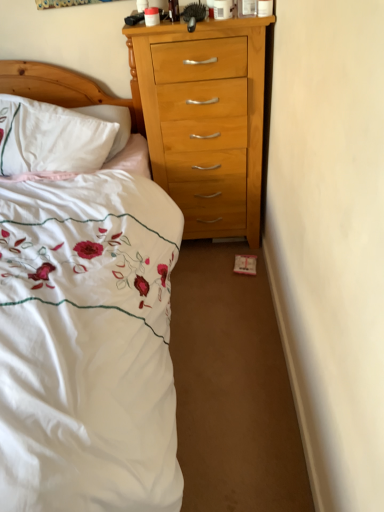
Question: Should I look upward or downward to see white embroidered bed at left?

Choices:
 (A) up
 (B) down

Answer: (B)

Question: Is white embroidered bed at left wider than white soft pillow at left?

Choices:
 (A) no
 (B) yes

Answer: (B)

Question: From the image's perspective, is white embroidered bed at left on white soft pillow at left?

Choices:
 (A) yes
 (B) no

Answer: (B)

Question: Is white embroidered bed at left facing towards white soft pillow at left?

Choices:
 (A) no
 (B) yes

Answer: (A)

Question: Does white embroidered bed at left have a larger size compared to white soft pillow at left?

Choices:
 (A) yes
 (B) no

Answer: (A)

Question: From a real-world perspective, is white embroidered bed at left under white soft pillow at left?

Choices:
 (A) yes
 (B) no

Answer: (A)

Question: Is white embroidered bed at left further to camera compared to white soft pillow at left?

Choices:
 (A) yes
 (B) no

Answer: (B)

Question: Considering the relative sizes of white soft pillow at left and white embroidered bed at left in the image provided, is white soft pillow at left thinner than white embroidered bed at left?

Choices:
 (A) yes
 (B) no

Answer: (A)

Question: From the image's perspective, is white soft pillow at left below white embroidered bed at left?

Choices:
 (A) no
 (B) yes

Answer: (A)

Question: From a real-world perspective, is white soft pillow at left physically above white embroidered bed at left?

Choices:
 (A) yes
 (B) no

Answer: (A)

Question: Is white soft pillow at left smaller than white embroidered bed at left?

Choices:
 (A) no
 (B) yes

Answer: (B)

Question: Can you confirm if white soft pillow at left is positioned to the left of white embroidered bed at left?

Choices:
 (A) no
 (B) yes

Answer: (B)

Question: Can you confirm if white soft pillow at left is positioned to the right of white embroidered bed at left?

Choices:
 (A) yes
 (B) no

Answer: (B)

Question: From the image's perspective, is white soft pillow at left above or below white embroidered bed at left?

Choices:
 (A) below
 (B) above

Answer: (B)